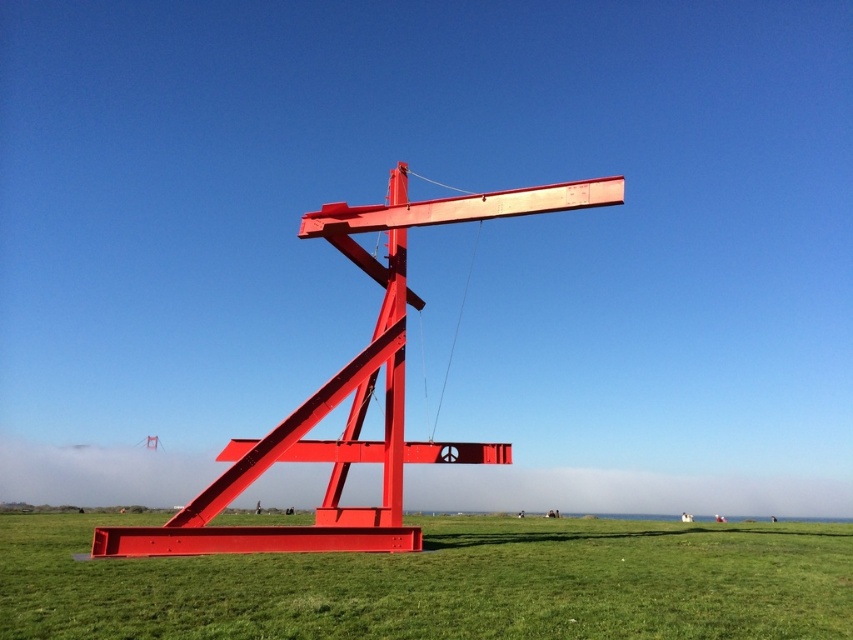
Which is more to the left, green grass at center or metallic red sculpture at center?

Positioned to the left is metallic red sculpture at center.

Is green grass at center further to camera compared to metallic red sculpture at center?

No, green grass at center is in front of metallic red sculpture at center.

Locate an element on the screen. The image size is (853, 640). green grass at center is located at coordinates (444, 584).